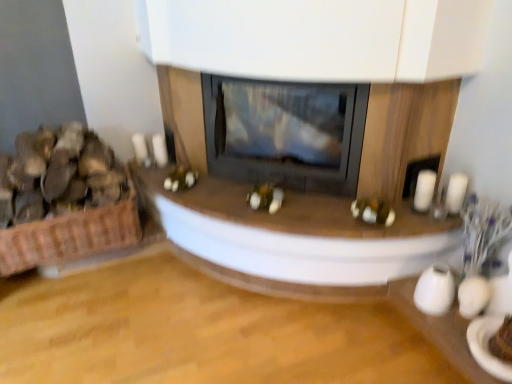
Question: Would you say wooden table at center is outside brown woven basket at left?

Choices:
 (A) yes
 (B) no

Answer: (A)

Question: Considering the relative positions of wooden table at center and brown woven basket at left in the image provided, is wooden table at center to the right of brown woven basket at left from the viewer's perspective?

Choices:
 (A) no
 (B) yes

Answer: (B)

Question: From the image's perspective, is wooden table at center over brown woven basket at left?

Choices:
 (A) no
 (B) yes

Answer: (A)

Question: From the image's perspective, is wooden table at center beneath brown woven basket at left?

Choices:
 (A) no
 (B) yes

Answer: (B)

Question: Does wooden table at center have a greater height compared to brown woven basket at left?

Choices:
 (A) yes
 (B) no

Answer: (B)

Question: Is wooden table at center at the left side of brown woven basket at left?

Choices:
 (A) no
 (B) yes

Answer: (A)

Question: Is brown woven basket at left to the left of wooden table at center from the viewer's perspective?

Choices:
 (A) no
 (B) yes

Answer: (B)

Question: Is brown woven basket at left bigger than wooden table at center?

Choices:
 (A) yes
 (B) no

Answer: (A)

Question: Is brown woven basket at left looking in the opposite direction of wooden table at center?

Choices:
 (A) no
 (B) yes

Answer: (A)

Question: Can you confirm if brown woven basket at left is taller than wooden table at center?

Choices:
 (A) no
 (B) yes

Answer: (B)

Question: Could you tell me if brown woven basket at left is facing wooden table at center?

Choices:
 (A) no
 (B) yes

Answer: (A)

Question: Is brown woven basket at left positioned far away from wooden table at center?

Choices:
 (A) yes
 (B) no

Answer: (B)

Question: Does white glossy candle at right, placed as the second candle when sorted from left to right, have a smaller size compared to brown woven basket at left?

Choices:
 (A) no
 (B) yes

Answer: (B)